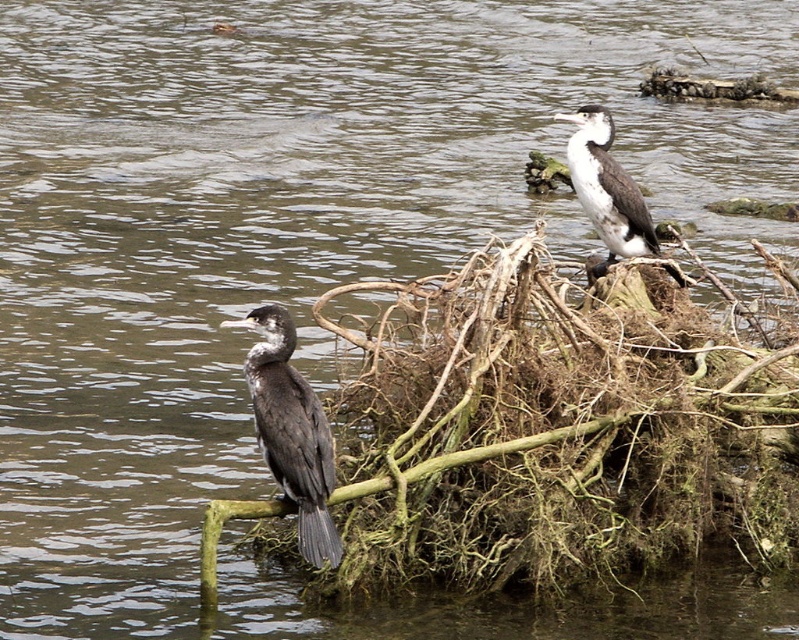
Question: From the image, what is the correct spatial relationship of dark gray feathers at left in relation to white-feathered bird at upper right?

Choices:
 (A) right
 (B) left

Answer: (B)

Question: Can you confirm if brown fibrous nest at lower center is thinner than white-feathered bird at upper right?

Choices:
 (A) yes
 (B) no

Answer: (B)

Question: Is brown fibrous nest at lower center smaller than dark gray feathers at left?

Choices:
 (A) no
 (B) yes

Answer: (A)

Question: Considering the real-world distances, which object is farthest from the dark gray feathers at left?

Choices:
 (A) brown fibrous nest at lower center
 (B) white-feathered bird at upper right

Answer: (B)

Question: Which object is positioned farthest from the dark gray feathers at left?

Choices:
 (A) white-feathered bird at upper right
 (B) brown fibrous nest at lower center

Answer: (A)

Question: Which of the following is the farthest from the observer?

Choices:
 (A) (650, 225)
 (B) (567, 339)
 (C) (309, 424)

Answer: (A)